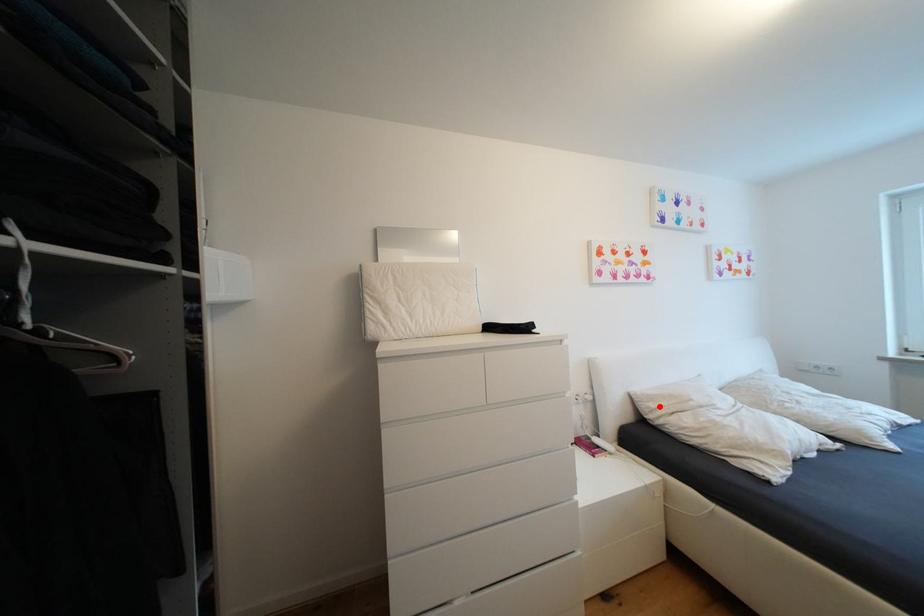
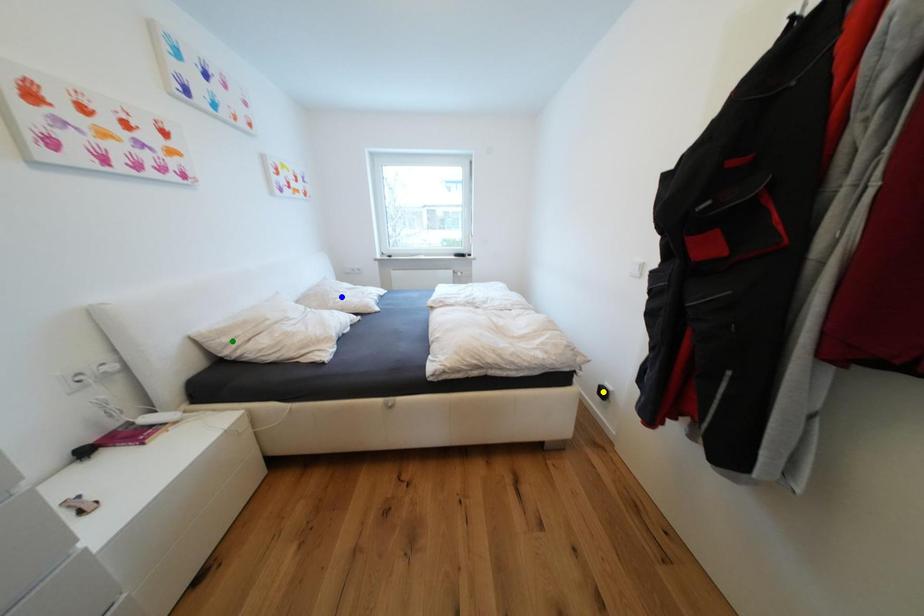
Question: I am providing you with two images of the same scene from different viewpoints. A red point is marked on the first image. You are given multiple points on the second image. Which spot in image 2 lines up with the point in image 1?

Choices:
 (A) green point
 (B) blue point
 (C) yellow point

Answer: (A)